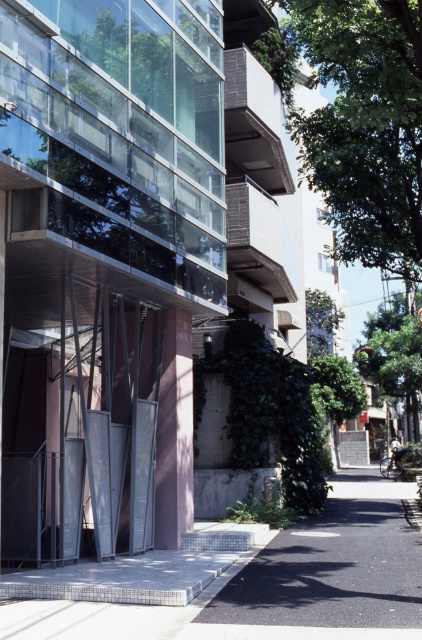
Who is lower down, gray concrete pavement at lower center or green leafy tree at right?

Positioned lower is gray concrete pavement at lower center.

Does gray concrete pavement at lower center have a smaller size compared to green leafy tree at right?

Indeed, gray concrete pavement at lower center has a smaller size compared to green leafy tree at right.

This screenshot has height=640, width=422. I want to click on gray concrete pavement at lower center, so click(278, 582).

Between green leafy tree at center and green leafy tree at right, which one is positioned lower?

green leafy tree at right is lower down.

The height and width of the screenshot is (640, 422). Describe the element at coordinates (359, 120) in the screenshot. I see `green leafy tree at center` at that location.

The image size is (422, 640). Identify the location of green leafy tree at center. (359, 120).

Is the position of gray concrete pavement at lower center more distant than that of green leafy tree at center?

No.

Who is positioned more to the right, gray concrete pavement at lower center or green leafy tree at center?

green leafy tree at center

Is point (394, 529) farther from camera compared to point (367, 97)?

Yes, it is behind point (367, 97).

Locate an element on the screen. Image resolution: width=422 pixels, height=640 pixels. gray concrete pavement at lower center is located at coordinates (278, 582).